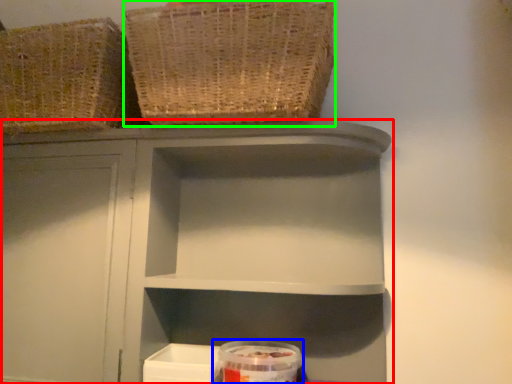
Question: Estimate the real-world distances between objects in this image. Which object is farther from shelf (highlighted by a red box), glass jar (highlighted by a blue box) or basket (highlighted by a green box)?

Choices:
 (A) glass jar
 (B) basket

Answer: (A)